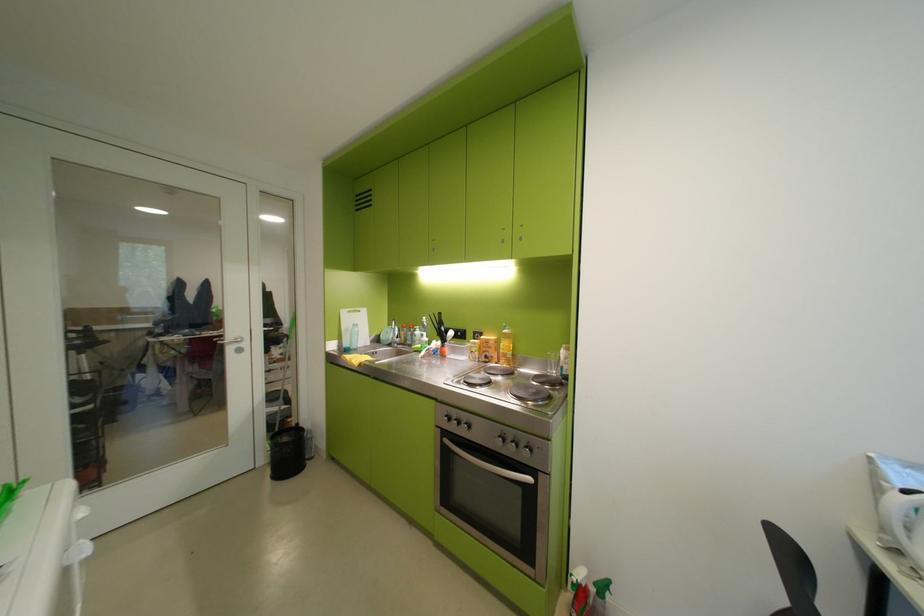
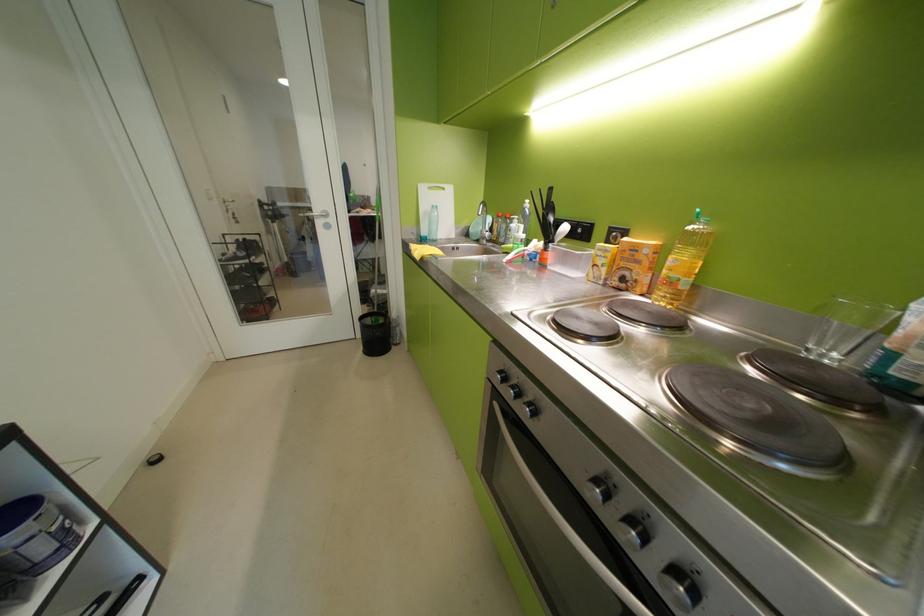
The point at (355, 314) is marked in the first image. Where is the corresponding point in the second image?

(433, 190)